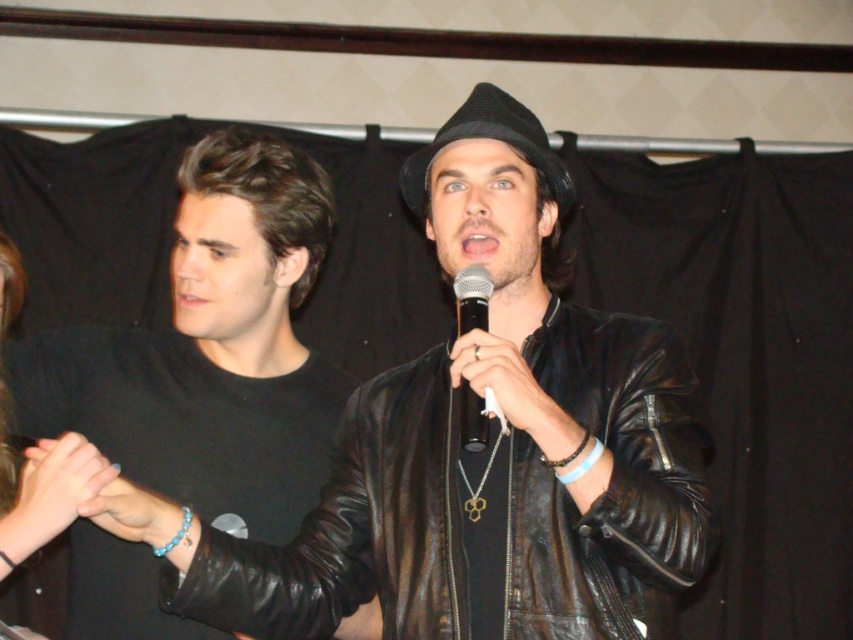
What are the coordinates of `black leather jacket at center` in the screenshot? It's located at (488, 508).

Which is behind, point (341, 554) or point (245, 200)?

Point (245, 200)

Image resolution: width=853 pixels, height=640 pixels. Identify the location of black leather jacket at center. (488, 508).

Image resolution: width=853 pixels, height=640 pixels. I want to click on black leather jacket at center, so (488, 508).

Describe the element at coordinates (212, 349) in the screenshot. The width and height of the screenshot is (853, 640). I see `black matte leather jacket at left` at that location.

Who is more forward, [140,557] or [485,316]?

Positioned in front is point [485,316].

Is point (223, 410) farther from camera compared to point (474, 420)?

Yes.

I want to click on black matte leather jacket at left, so click(x=212, y=349).

Does black leather jacket at center have a smaller size compared to black felt fedora at center?

No.

Does black leather jacket at center have a larger size compared to black felt fedora at center?

Yes.

At what (x,y) coordinates should I click in order to perform the action: click on black leather jacket at center. Please return your answer as a coordinate pair (x, y). Looking at the image, I should click on (488, 508).